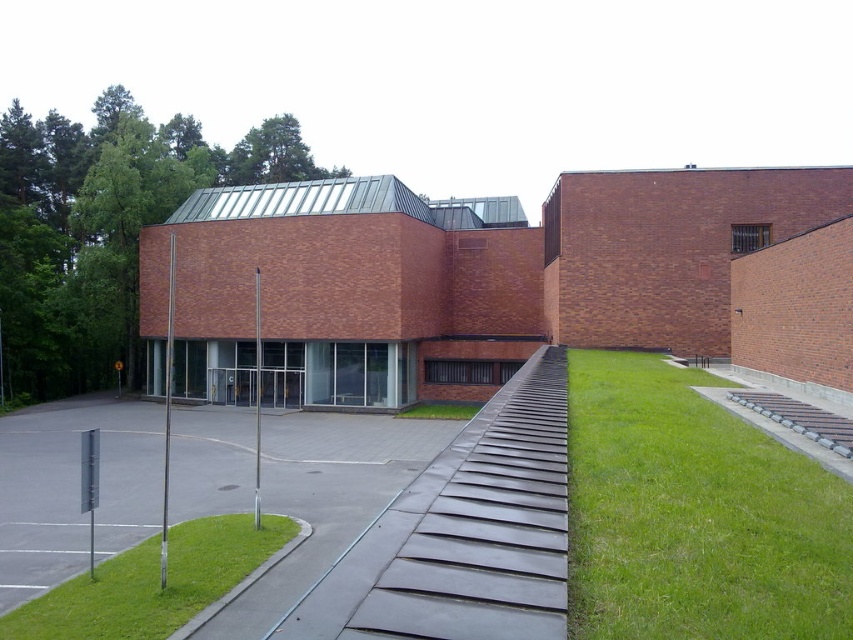
Between green grass at lower left and green grass at lower center, which one is positioned higher?

green grass at lower left is higher up.

Who is positioned more to the right, green grass at lower left or green grass at lower center?

green grass at lower center

What are the coordinates of `green grass at lower left` in the screenshot? It's located at (151, 582).

From the picture: Between green grass at lower right and gray concrete path at center, which one has more height?

gray concrete path at center is taller.

Between point (791, 588) and point (86, 412), which one is positioned in front?

Positioned in front is point (791, 588).

In order to click on green grass at lower right in this screenshot , I will do `click(694, 515)`.

Is point (4, 608) in front of point (412, 410)?

Yes, it is in front of point (412, 410).

Is point (334, 513) positioned after point (440, 403)?

That is False.

Which is in front, point (56, 509) or point (451, 417)?

Point (56, 509)

The height and width of the screenshot is (640, 853). In order to click on gray concrete path at center in this screenshot , I will do `click(73, 490)`.